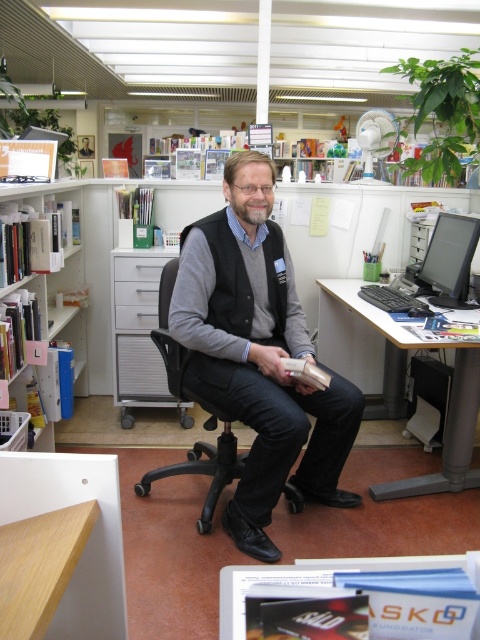
Question: Estimate the real-world distances between objects in this image. Which object is farther from the gray wool vest at center?

Choices:
 (A) white plastic bookshelf at left
 (B) white plastic computer desk at right

Answer: (A)

Question: Does gray wool vest at center have a lesser width compared to white plastic computer desk at right?

Choices:
 (A) yes
 (B) no

Answer: (B)

Question: Which point is farther to the camera?

Choices:
 (A) white plastic computer desk at right
 (B) gray wool vest at center

Answer: (A)

Question: Can you confirm if white plastic computer desk at right is wider than white plastic bookshelf at left?

Choices:
 (A) no
 (B) yes

Answer: (B)

Question: Which of the following is the farthest from the observer?

Choices:
 (A) white plastic computer desk at right
 (B) gray wool vest at center

Answer: (A)

Question: Can you confirm if gray wool vest at center is positioned below white plastic computer desk at right?

Choices:
 (A) no
 (B) yes

Answer: (B)